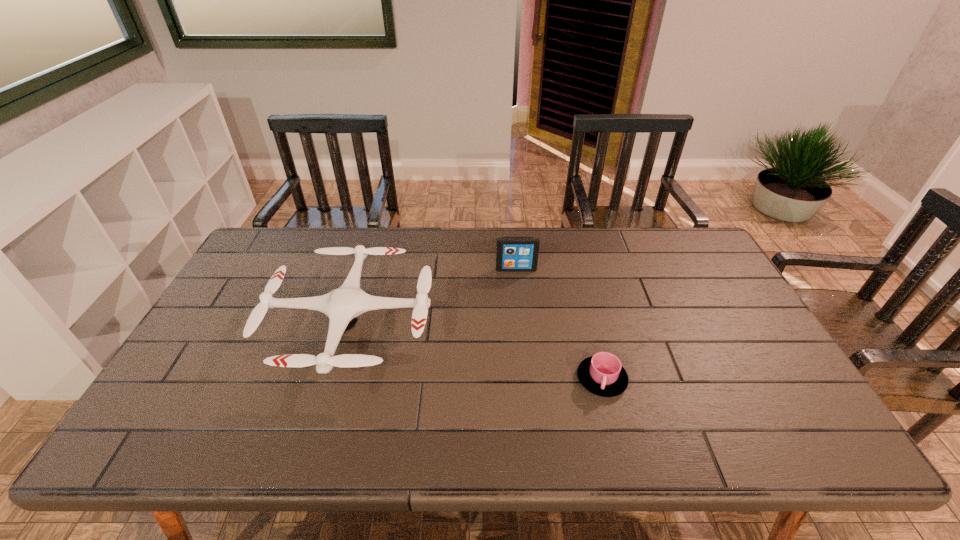
Locate an element on the screen. The width and height of the screenshot is (960, 540). free point between the farthest object and the leftmost object is located at coordinates (434, 297).

Locate an element on the screen. The image size is (960, 540). free space between the leftmost object and the cup is located at coordinates (476, 352).

Locate an element on the screen. This screenshot has width=960, height=540. vacant space in between the drone and the shortest object is located at coordinates (476, 352).

Where is `vacant space that is in between the drone and the farthest object`? vacant space that is in between the drone and the farthest object is located at coordinates (434, 297).

Find the location of a particular element. The width and height of the screenshot is (960, 540). free space between the leftmost object and the cup is located at coordinates (476, 352).

Where is `free space that is in between the drone and the second object from right to left`? free space that is in between the drone and the second object from right to left is located at coordinates (434, 297).

Locate an element on the screen. Image resolution: width=960 pixels, height=540 pixels. object that is the second closest one to the farthest object is located at coordinates (602, 374).

Identify which object is the second nearest to the farthest object. Please provide its 2D coordinates. Your answer should be formatted as a tuple, i.e. [(x, y)], where the tuple contains the x and y coordinates of a point satisfying the conditions above.

[(602, 374)]